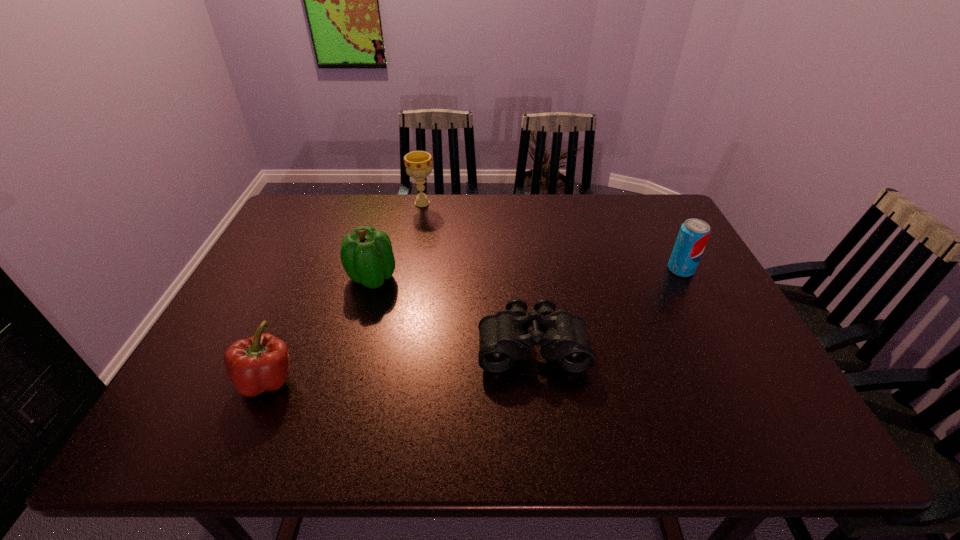
Where is `vacant position at the far right corner of the desktop`? The height and width of the screenshot is (540, 960). vacant position at the far right corner of the desktop is located at coordinates (644, 212).

Locate an element on the screen. free spot between the soda can and the leftmost object is located at coordinates (474, 325).

You are a GUI agent. You are given a task and a screenshot of the screen. Output one action in this format:
    pyautogui.click(x=<x>, y=<y>)
    Task: Click on the free space between the left bell pepper and the binoculars
    
    Given the screenshot: What is the action you would take?
    pyautogui.click(x=399, y=362)

You are a GUI agent. You are given a task and a screenshot of the screen. Output one action in this format:
    pyautogui.click(x=<x>, y=<y>)
    Task: Click on the vacant area that lies between the soda can and the chalice
    
    Given the screenshot: What is the action you would take?
    pyautogui.click(x=552, y=237)

Find the location of `free area in between the second object from right to left and the farther bell pepper`. free area in between the second object from right to left and the farther bell pepper is located at coordinates (452, 312).

I want to click on empty space that is in between the right bell pepper and the binoculars, so click(x=452, y=312).

This screenshot has height=540, width=960. Find the location of `vacant region between the rightmost object and the fourth object from left to right`. vacant region between the rightmost object and the fourth object from left to right is located at coordinates (607, 307).

This screenshot has width=960, height=540. Identify the location of empty space that is in between the shortest object and the farthest object. (477, 274).

Find the location of a particular element. free spot between the fourth object from left to right and the chalice is located at coordinates (477, 274).

Locate an element on the screen. The width and height of the screenshot is (960, 540). vacant space that is in between the farther bell pepper and the binoculars is located at coordinates (452, 312).